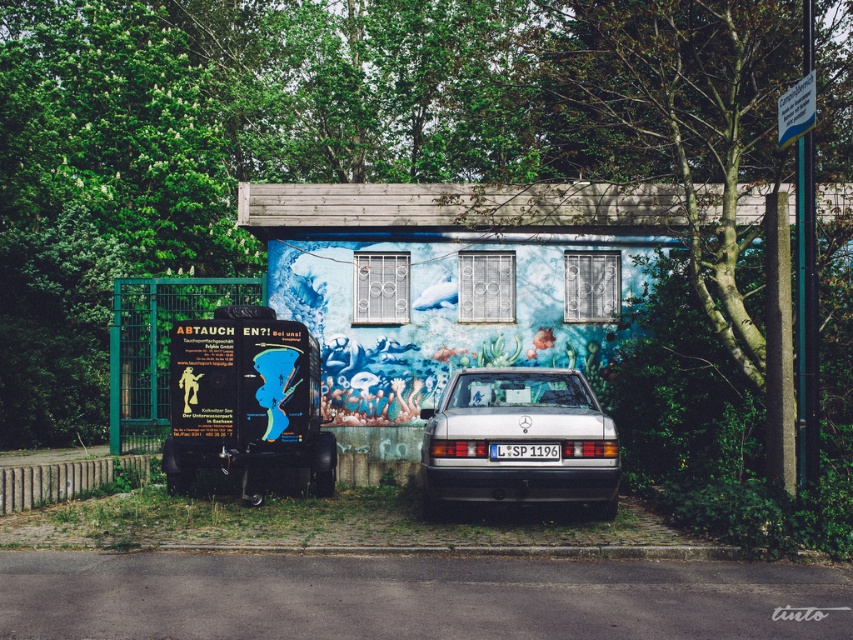
Question: Which object appears closest to the camera in this image?

Choices:
 (A) white plastic license plate at center
 (B) silver metallic car at center

Answer: (B)

Question: Does silver metallic car at center have a larger size compared to white plastic license plate at center?

Choices:
 (A) no
 (B) yes

Answer: (B)

Question: Is silver metallic car at center to the right of white plastic license plate at center from the viewer's perspective?

Choices:
 (A) no
 (B) yes

Answer: (A)

Question: Is silver metallic car at center closer to the viewer compared to white plastic license plate at center?

Choices:
 (A) yes
 (B) no

Answer: (A)